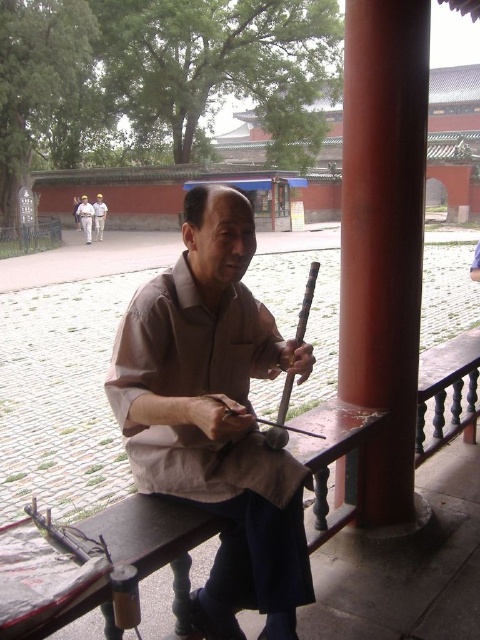
Question: Is light brown cotton shirt at center to the left of brown cotton shirt at center from the viewer's perspective?

Choices:
 (A) no
 (B) yes

Answer: (B)

Question: Among these points, which one is nearest to the camera?

Choices:
 (A) (247, 372)
 (B) (84, 209)

Answer: (A)

Question: In this image, where is light brown cotton shirt at center located relative to brown cotton shirt at center?

Choices:
 (A) right
 (B) left

Answer: (B)

Question: Which point is farther to the camera?

Choices:
 (A) light brown cotton shirt at center
 (B) brown cotton shirt at center
 (C) smooth red wood at center
 (D) brown matte shirt at center

Answer: (B)

Question: Can you confirm if brown matte shirt at center is wider than smooth red wood at center?

Choices:
 (A) no
 (B) yes

Answer: (B)

Question: Which object is the farthest from the light brown cotton shirt at center?

Choices:
 (A) brown matte shirt at center
 (B) brown cotton shirt at center
 (C) smooth red wood at center

Answer: (A)